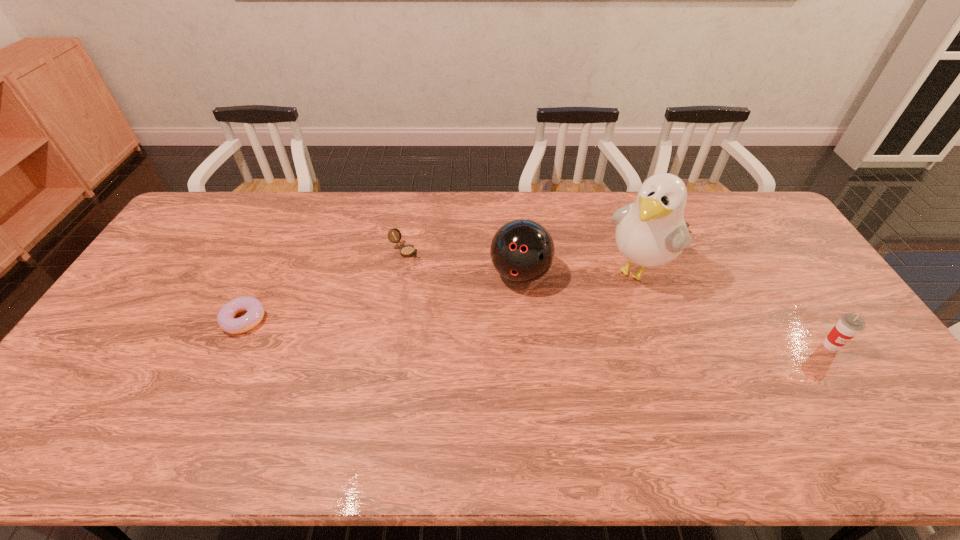
The height and width of the screenshot is (540, 960). I want to click on free spot on the desktop that is between the second nearest object and the nearest object and is positioned on the beak of the second object from right to left, so click(581, 334).

You are a GUI agent. You are given a task and a screenshot of the screen. Output one action in this format:
    pyautogui.click(x=<x>, y=<y>)
    Task: Click on the vacant space on the desktop that is between the leftmost object and the cup and is positioned on the surface of the third object from right to left near the finger holes
    This screenshot has height=540, width=960.
    Given the screenshot: What is the action you would take?
    pyautogui.click(x=499, y=331)

Locate an element on the screen. The width and height of the screenshot is (960, 540). vacant space on the desktop that is between the second nearest object and the nearest object and is positioned on the face of the compass is located at coordinates (539, 333).